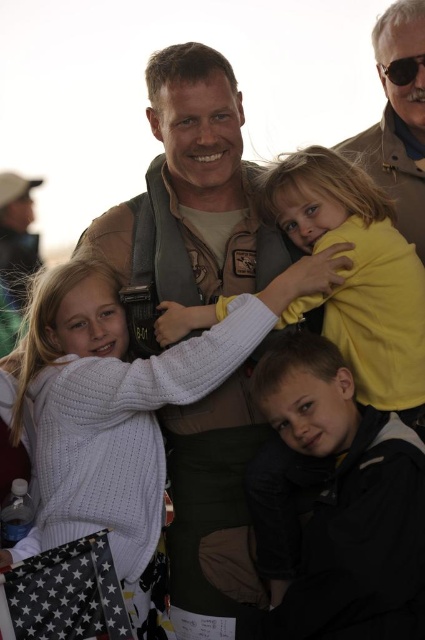
Question: Which object is the closest to the yellow matte shirt at upper center?

Choices:
 (A) brown leather jacket at upper right
 (B) black plastic goggles at upper right
 (C) dark gray fleece jacket at lower right
 (D) white knitted sweater at lower left

Answer: (C)

Question: Does dark gray fleece jacket at lower right have a lesser width compared to yellow matte shirt at upper center?

Choices:
 (A) yes
 (B) no

Answer: (A)

Question: From the image, what is the correct spatial relationship of white knitted sweater at lower left in relation to brown leather jacket at upper right?

Choices:
 (A) above
 (B) below

Answer: (B)

Question: Considering the real-world distances, which object is closest to the white knitted sweater at lower left?

Choices:
 (A) yellow matte shirt at upper center
 (B) dark gray fleece jacket at lower right
 (C) brown leather jacket at upper right

Answer: (B)

Question: Which point appears closest to the camera in this image?

Choices:
 (A) (328, 332)
 (B) (416, 145)

Answer: (A)

Question: Considering the relative positions of white knitted sweater at lower left and dark gray fleece jacket at lower right in the image provided, where is white knitted sweater at lower left located with respect to dark gray fleece jacket at lower right?

Choices:
 (A) below
 (B) above

Answer: (B)